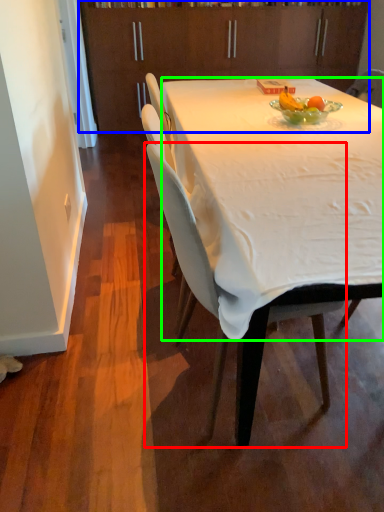
Question: Considering the real-world distances, which object is farthest from chair (highlighted by a red box)? cabinetry (highlighted by a blue box) or desk (highlighted by a green box)?

Choices:
 (A) cabinetry
 (B) desk

Answer: (A)